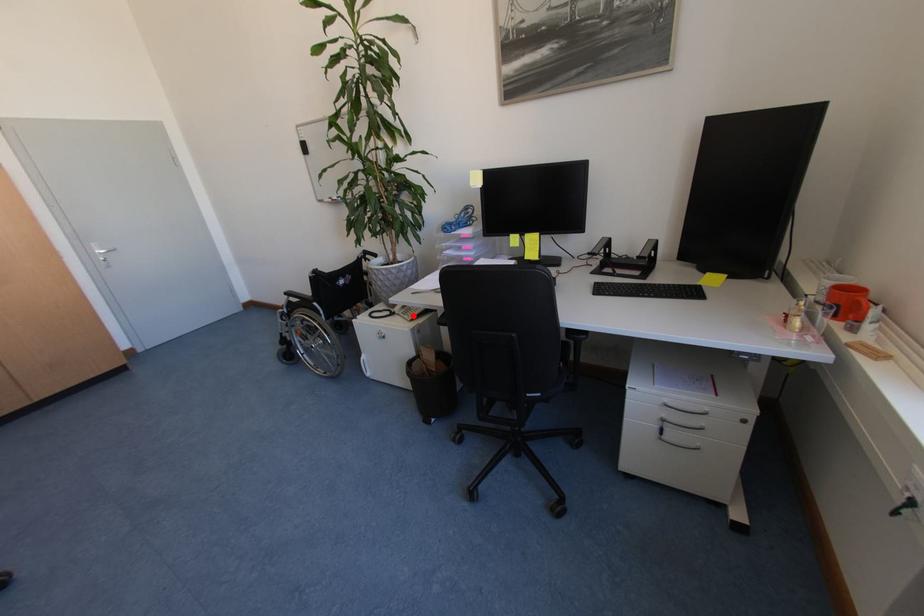
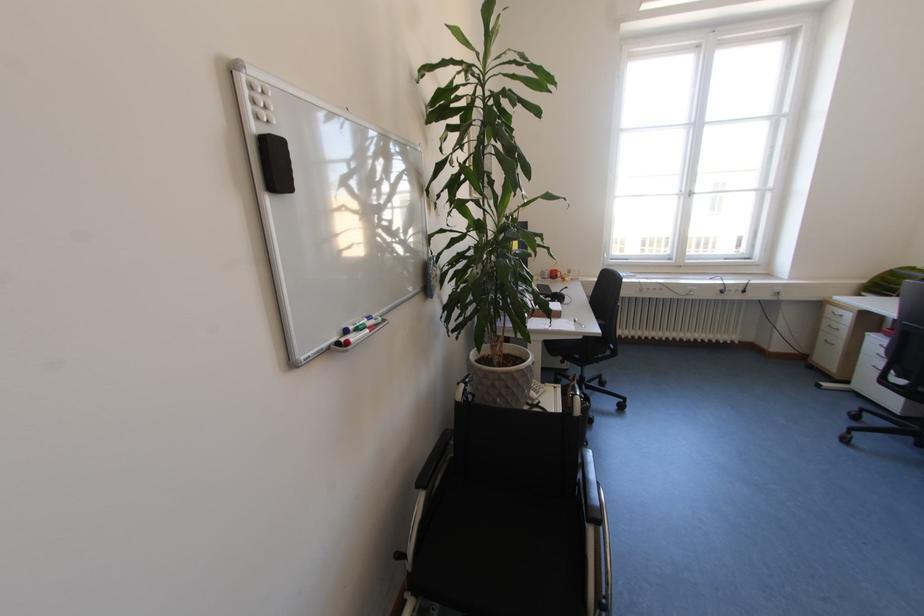
Question: I am providing you with two images of the same scene from different viewpoints. Given a red point in image1, look at the same physical point in image2. Is it:

Choices:
 (A) Closer to the viewpoint
 (B) Farther from the viewpoint

Answer: (B)